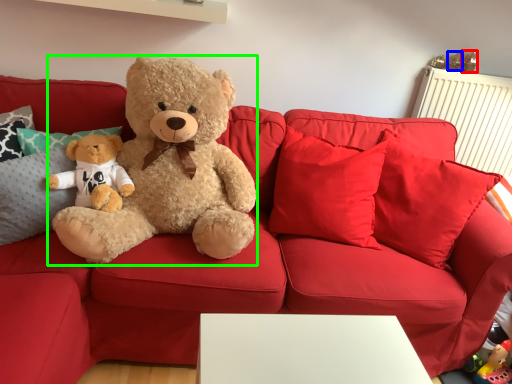
Question: Which object is the closest to the toy (highlighted by a red box)? Choose among these: toy (highlighted by a blue box) or teddy bear (highlighted by a green box).

Choices:
 (A) toy
 (B) teddy bear

Answer: (A)